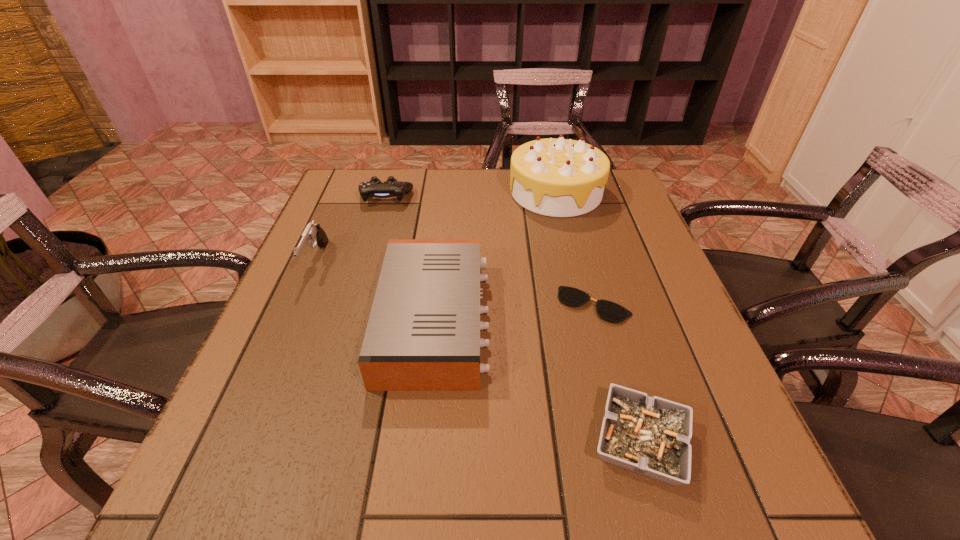
What are the coordinates of `spectacles at the right edge` in the screenshot? It's located at (613, 312).

Locate an element on the screen. This screenshot has width=960, height=540. object that is at the far left corner is located at coordinates 374,188.

You are a GUI agent. You are given a task and a screenshot of the screen. Output one action in this format:
    pyautogui.click(x=<x>, y=<y>)
    Task: Click on the object that is at the far right corner
    
    Given the screenshot: What is the action you would take?
    pyautogui.click(x=560, y=177)

At what (x,y) coordinates should I click in order to perform the action: click on object present at the near right corner. Please return your answer as a coordinate pair (x, y). The height and width of the screenshot is (540, 960). Looking at the image, I should click on (651, 436).

Image resolution: width=960 pixels, height=540 pixels. In the image, there is a desktop. Identify the location of free space at the far edge. [x=414, y=187].

The height and width of the screenshot is (540, 960). I want to click on free region at the near edge of the desktop, so click(x=530, y=480).

I want to click on vacant space at the left edge of the desktop, so (x=350, y=250).

The image size is (960, 540). I want to click on vacant region at the right edge of the desktop, so click(658, 368).

Identify the location of vacant area at the far left corner. (375, 210).

This screenshot has height=540, width=960. Identify the location of vacant point located between the third tallest object and the ashtray. (538, 381).